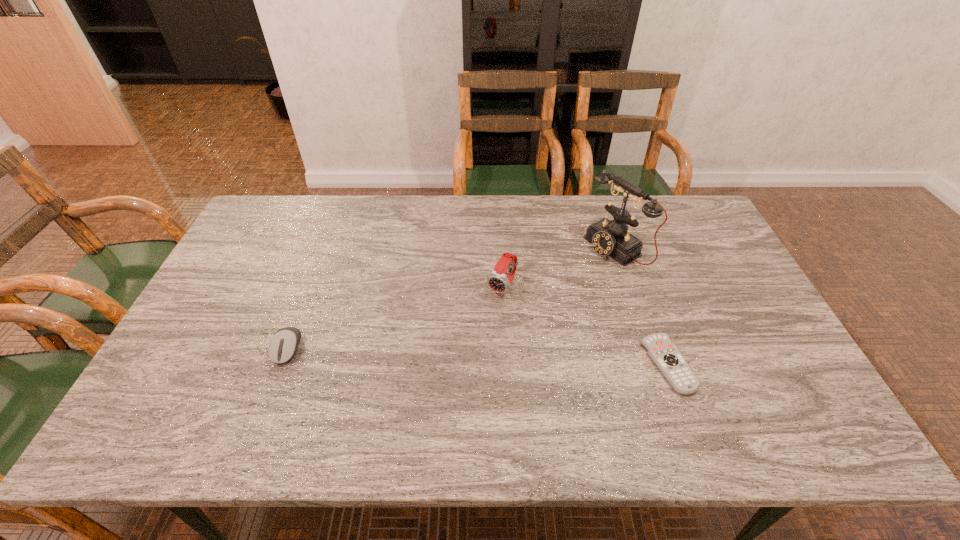
Locate an element on the screen. the second shortest object is located at coordinates (283, 346).

Where is `computer equipment`? The width and height of the screenshot is (960, 540). computer equipment is located at coordinates (283, 346).

Locate an element on the screen. The height and width of the screenshot is (540, 960). the shortest object is located at coordinates (666, 356).

At what (x,y) coordinates should I click in order to perform the action: click on watch. Please return your answer as a coordinate pair (x, y). Image resolution: width=960 pixels, height=540 pixels. Looking at the image, I should click on (498, 281).

Find the location of a particular element. the third object from right to left is located at coordinates (498, 281).

The image size is (960, 540). In order to click on telephone in this screenshot , I will do (612, 238).

The width and height of the screenshot is (960, 540). In order to click on vacant area located 0.090m on the wheel side of the third tallest object in this screenshot , I will do [x=269, y=399].

Identify the location of vacant space located on the left of the shortest object. (492, 364).

Identify the location of vacant space located 0.130m on the face of the second tallest object. The height and width of the screenshot is (540, 960). (475, 333).

This screenshot has width=960, height=540. I want to click on free spot located on the face of the second tallest object, so click(473, 335).